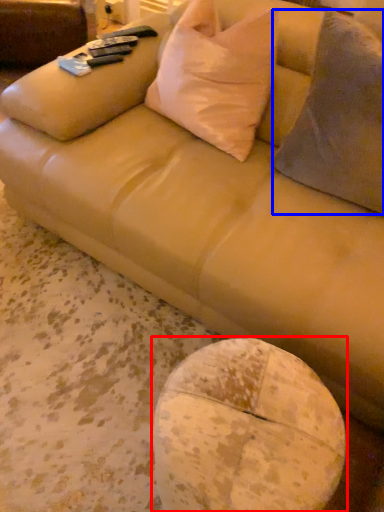
Question: Among these objects, which one is nearest to the camera, round table (highlighted by a red box) or throw pillow (highlighted by a blue box)?

Choices:
 (A) round table
 (B) throw pillow

Answer: (A)